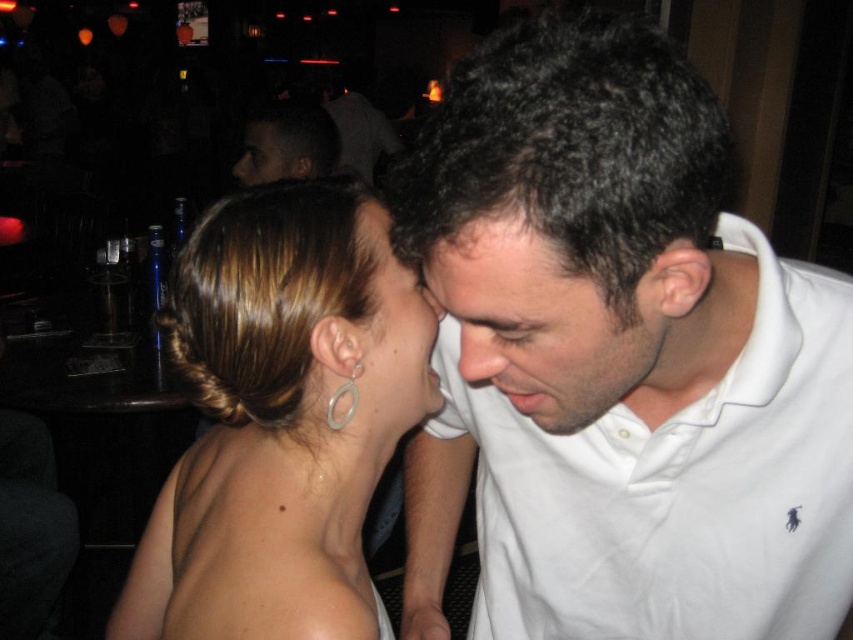
Question: Which object is farther from the camera taking this photo?

Choices:
 (A) matte black face at upper center
 (B) satin white dress at upper center

Answer: (A)

Question: Is dark skin head at upper left positioned in front of silver metallic hoop at ear?

Choices:
 (A) yes
 (B) no

Answer: (B)

Question: Is white cotton polo shirt at center above silver metallic hoop at ear?

Choices:
 (A) no
 (B) yes

Answer: (A)

Question: Which of the following is the farthest from the observer?

Choices:
 (A) white cotton polo shirt at center
 (B) matte white forehead at center
 (C) satin gold earring at center
 (D) silver metallic hoop at ear

Answer: (D)

Question: Can you confirm if white cotton polo shirt at center is bigger than matte black face at upper center?

Choices:
 (A) yes
 (B) no

Answer: (A)

Question: Estimate the real-world distances between objects in this image. Which object is farther from the satin gold earring at center?

Choices:
 (A) satin white dress at upper center
 (B) matte black face at upper center
 (C) silver metallic hoop at ear

Answer: (B)